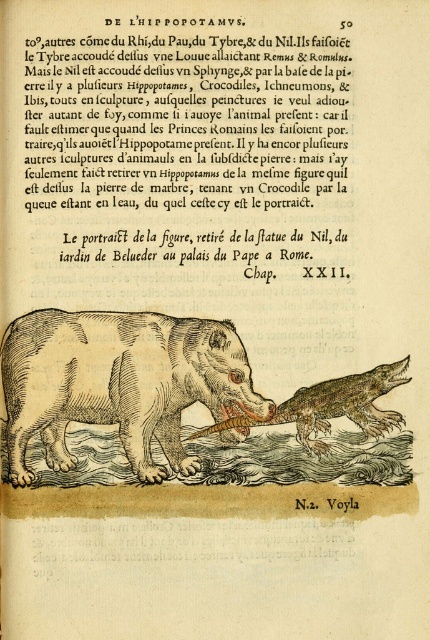
Between brown wood carving hippopotamus at center and brown textured crocodile at center, which one appears on the right side from the viewer's perspective?

brown textured crocodile at center is more to the right.

Does brown wood carving hippopotamus at center have a greater height compared to brown textured crocodile at center?

Correct, brown wood carving hippopotamus at center is much taller as brown textured crocodile at center.

Which is in front, point (169, 356) or point (343, 381)?

Point (169, 356) is more forward.

This screenshot has width=430, height=640. Find the location of `brown wood carving hippopotamus at center`. brown wood carving hippopotamus at center is located at coordinates (119, 381).

Who is more distant from viewer, (64, 188) or (316, 426)?

The point (316, 426) is more distant.

Is black wood text at upper center below brown textured crocodile at center?

Actually, black wood text at upper center is above brown textured crocodile at center.

Between point (110, 104) and point (322, 420), which one is positioned in front?

Point (110, 104) is more forward.

Locate an element on the screen. The image size is (430, 640). black wood text at upper center is located at coordinates click(190, 147).

Can you confirm if black wood text at upper center is shorter than brown wood carving hippopotamus at center?

In fact, black wood text at upper center may be taller than brown wood carving hippopotamus at center.

Find the location of `black wood text at upper center`. black wood text at upper center is located at coordinates (190, 147).

Image resolution: width=430 pixels, height=640 pixels. What do you see at coordinates (190, 147) in the screenshot?
I see `black wood text at upper center` at bounding box center [190, 147].

Image resolution: width=430 pixels, height=640 pixels. In order to click on black wood text at upper center in this screenshot , I will do `click(190, 147)`.